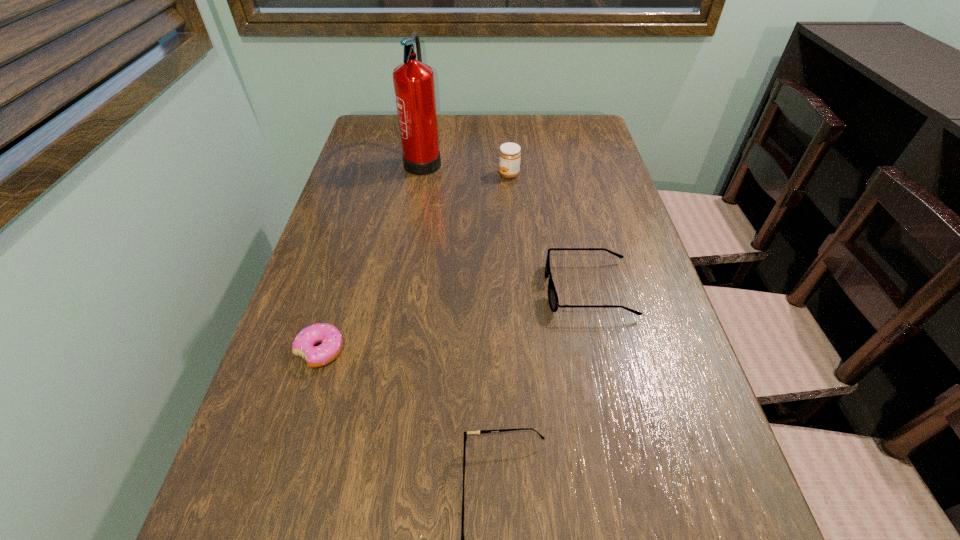
Find the location of a particular element. The height and width of the screenshot is (540, 960). free space at the far edge is located at coordinates (484, 121).

This screenshot has height=540, width=960. I want to click on vacant space at the left edge of the desktop, so click(x=375, y=206).

This screenshot has height=540, width=960. In the image, there is a desktop. Find the location of `vacant region at the right edge`. vacant region at the right edge is located at coordinates (570, 234).

Find the location of a particular element. vacant space at the far left corner is located at coordinates (385, 131).

At what (x,y) coordinates should I click in order to perform the action: click on vacant area at the far right corner of the desktop. Please return your answer as a coordinate pair (x, y). The image size is (960, 540). Looking at the image, I should click on (584, 150).

What are the coordinates of `vacant space in between the third farthest object and the jam` in the screenshot? It's located at (548, 232).

I want to click on free space between the fire extinguisher and the right spectacles, so click(506, 224).

This screenshot has height=540, width=960. In order to click on free space between the shortest object and the fourth shortest object in this screenshot , I will do `click(415, 262)`.

Where is `empty space between the third farthest object and the second object from left to right`? The image size is (960, 540). empty space between the third farthest object and the second object from left to right is located at coordinates (506, 224).

Identify which object is the closest to the left spectacles. Please provide its 2D coordinates. Your answer should be formatted as a tuple, i.e. [(x, y)], where the tuple contains the x and y coordinates of a point satisfying the conditions above.

[(553, 299)]